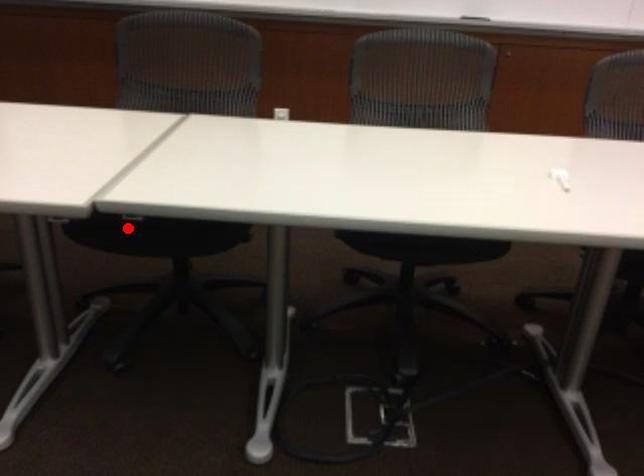
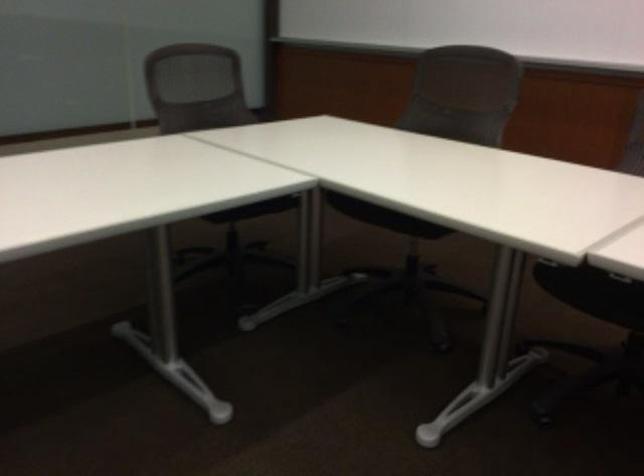
Find the pixel in the second image that matches the highlighted location in the first image.

(592, 292)